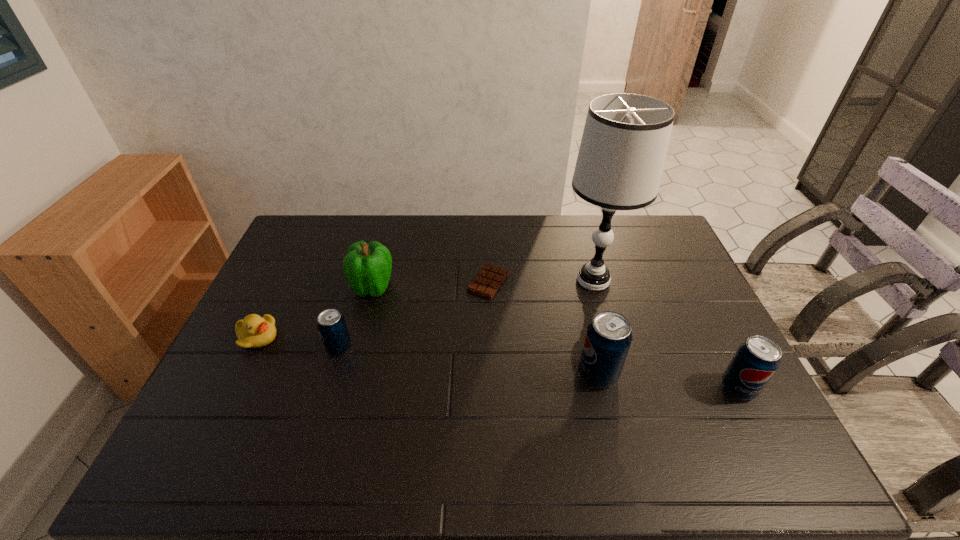
Identify the location of free space between the second soda can from right to left and the fifth tallest object. Image resolution: width=960 pixels, height=540 pixels. (468, 361).

Where is `free space that is in between the duckling and the shortest soda can`? The image size is (960, 540). free space that is in between the duckling and the shortest soda can is located at coordinates (299, 342).

The height and width of the screenshot is (540, 960). Find the location of `empty space that is in between the tallest soda can and the third shortest object`. empty space that is in between the tallest soda can and the third shortest object is located at coordinates (468, 361).

I want to click on free spot between the bell pepper and the shortest soda can, so click(x=356, y=318).

Find the location of a particular element. free space that is in between the shortest soda can and the bell pepper is located at coordinates (356, 318).

Select which object appears as the closest to the bell pepper. Please provide its 2D coordinates. Your answer should be formatted as a tuple, i.e. [(x, y)], where the tuple contains the x and y coordinates of a point satisfying the conditions above.

[(331, 324)]

The width and height of the screenshot is (960, 540). Find the location of `object that is the sixth closest to the third shortest object`. object that is the sixth closest to the third shortest object is located at coordinates (756, 360).

Locate which soda can is the second closest to the second soda can from right to left. Please provide its 2D coordinates. Your answer should be formatted as a tuple, i.e. [(x, y)], where the tuple contains the x and y coordinates of a point satisfying the conditions above.

[(331, 324)]

Locate which soda can is the second closest to the shortest object. Please provide its 2D coordinates. Your answer should be formatted as a tuple, i.e. [(x, y)], where the tuple contains the x and y coordinates of a point satisfying the conditions above.

[(331, 324)]

Find the location of a particular element. free space that satisfies the following two spatial constraints: 1. on the front side of the second soda can from left to right; 2. on the left side of the rightmost object is located at coordinates (601, 388).